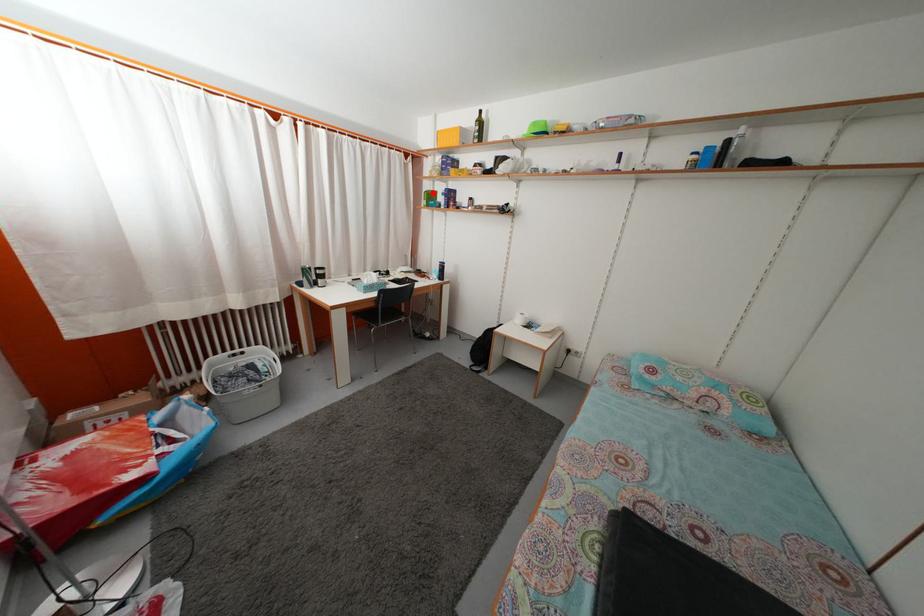
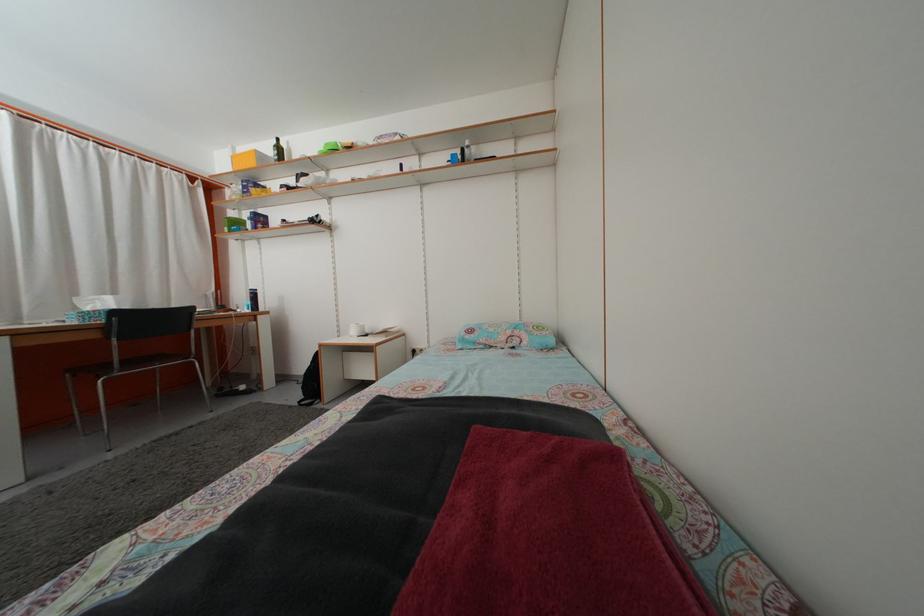
The point at the highlighted location is marked in the first image. Where is the corresponding point in the second image?

(237, 223)